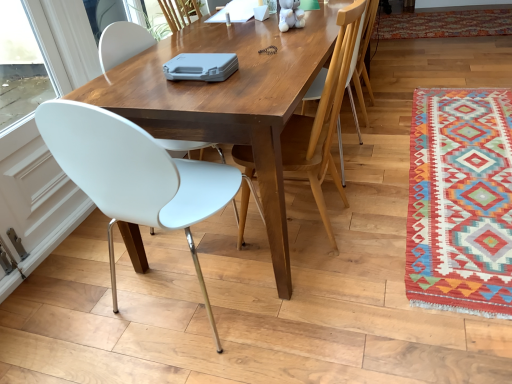
Question: Considering the relative positions of multicolored woven rug at right, placed as the 2th mat when sorted from bottom to top, and white plastic chair at left, which is the 3th chair in right-to-left order, in the image provided, is multicolored woven rug at right, placed as the 2th mat when sorted from bottom to top, to the right of white plastic chair at left, which is the 3th chair in right-to-left order, from the viewer's perspective?

Choices:
 (A) yes
 (B) no

Answer: (A)

Question: Considering the relative sizes of multicolored woven rug at right, acting as the 1th mat starting from the back, and white plastic chair at left, the first chair when ordered from left to right, in the image provided, is multicolored woven rug at right, acting as the 1th mat starting from the back, taller than white plastic chair at left, the first chair when ordered from left to right,?

Choices:
 (A) no
 (B) yes

Answer: (A)

Question: Considering the relative sizes of multicolored woven rug at right, the first mat viewed from the top, and white plastic chair at left, which is the 3th chair in right-to-left order, in the image provided, is multicolored woven rug at right, the first mat viewed from the top, thinner than white plastic chair at left, which is the 3th chair in right-to-left order,?

Choices:
 (A) yes
 (B) no

Answer: (B)

Question: Does multicolored woven rug at right, the 2th mat viewed from the front, have a lesser height compared to white plastic chair at left, the first chair when ordered from left to right?

Choices:
 (A) yes
 (B) no

Answer: (A)

Question: From the image's perspective, would you say multicolored woven rug at right, the 2th mat viewed from the front, is positioned over white plastic chair at left, the first chair when ordered from left to right?

Choices:
 (A) yes
 (B) no

Answer: (A)

Question: Can you confirm if multicolored woven rug at right, the 2th mat viewed from the front, is smaller than white plastic chair at left, the first chair when ordered from left to right?

Choices:
 (A) yes
 (B) no

Answer: (A)

Question: Is multicolored woven rug at lower right, positioned as the 1th mat in bottom-to-top order, looking in the opposite direction of white plastic chair at left, the first chair when ordered from left to right?

Choices:
 (A) yes
 (B) no

Answer: (B)

Question: Does multicolored woven rug at lower right, which is counted as the 1th mat, starting from the front, appear on the left side of white plastic chair at left, the first chair when ordered from left to right?

Choices:
 (A) yes
 (B) no

Answer: (B)

Question: From a real-world perspective, is multicolored woven rug at lower right, which appears as the second mat when viewed from the back, on top of white plastic chair at left, the first chair when ordered from left to right?

Choices:
 (A) no
 (B) yes

Answer: (A)

Question: Is there a large distance between multicolored woven rug at lower right, which appears as the second mat when viewed from the back, and white plastic chair at left, which is the 3th chair in right-to-left order?

Choices:
 (A) yes
 (B) no

Answer: (A)

Question: Does multicolored woven rug at lower right, which is counted as the 1th mat, starting from the front, lie behind white plastic chair at left, the first chair when ordered from left to right?

Choices:
 (A) yes
 (B) no

Answer: (A)

Question: Is multicolored woven rug at lower right, acting as the 2th mat starting from the top, aimed at white plastic chair at left, which is the 3th chair in right-to-left order?

Choices:
 (A) no
 (B) yes

Answer: (A)

Question: Is wooden chair at upper right, the 3th chair in the left-to-right sequence, in contact with multicolored woven rug at lower right, which appears as the second mat when viewed from the back?

Choices:
 (A) no
 (B) yes

Answer: (A)